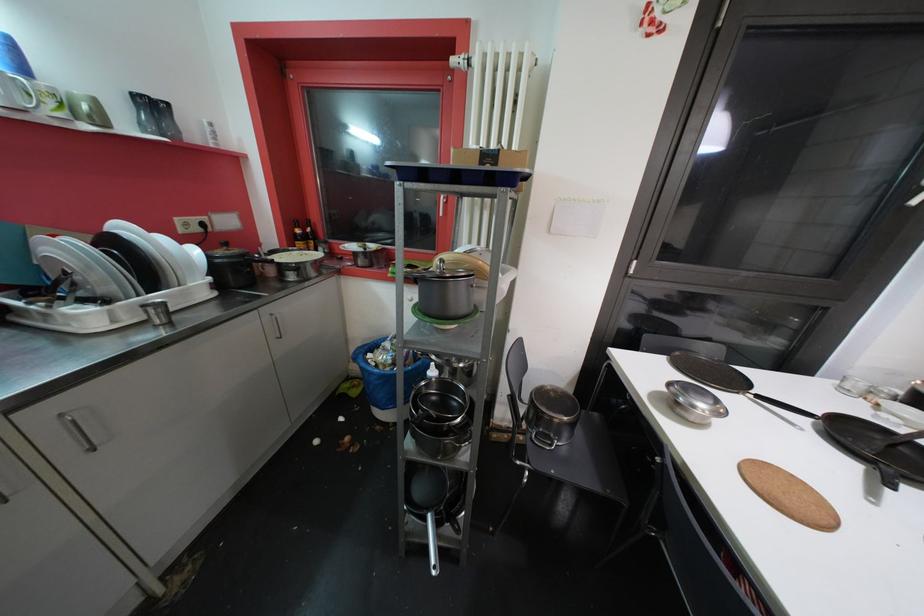
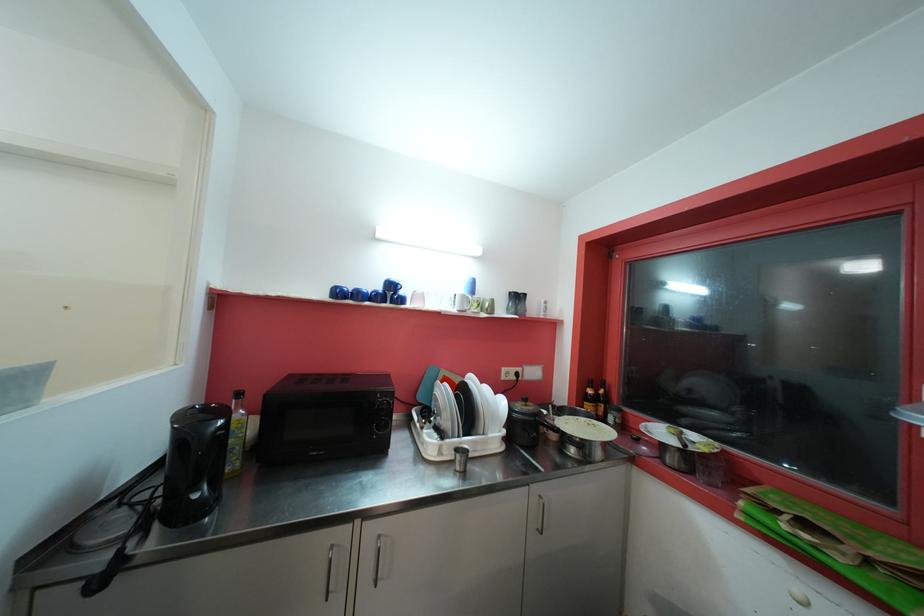
Locate, in the second image, the point that corresponds to pixel 365 265 in the first image.

(675, 462)